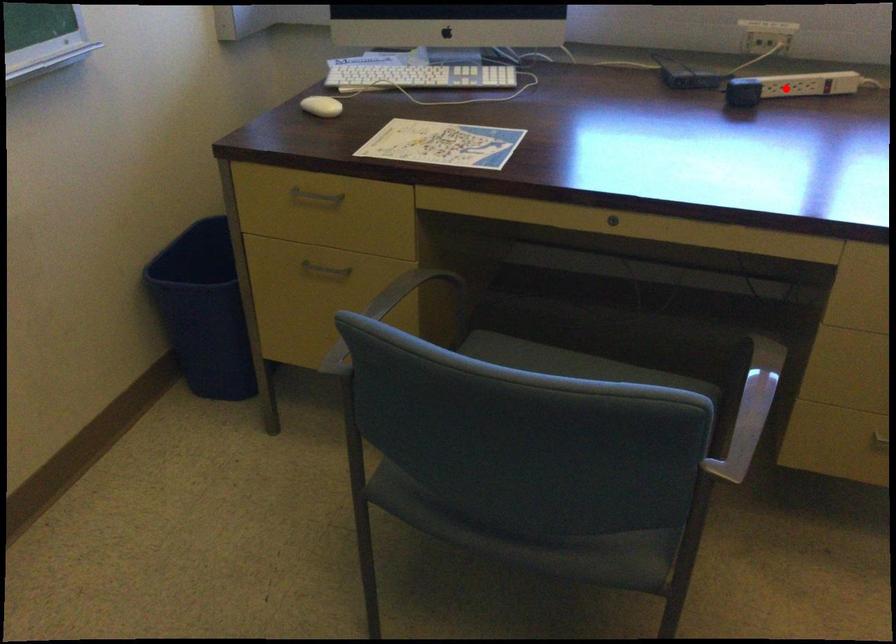
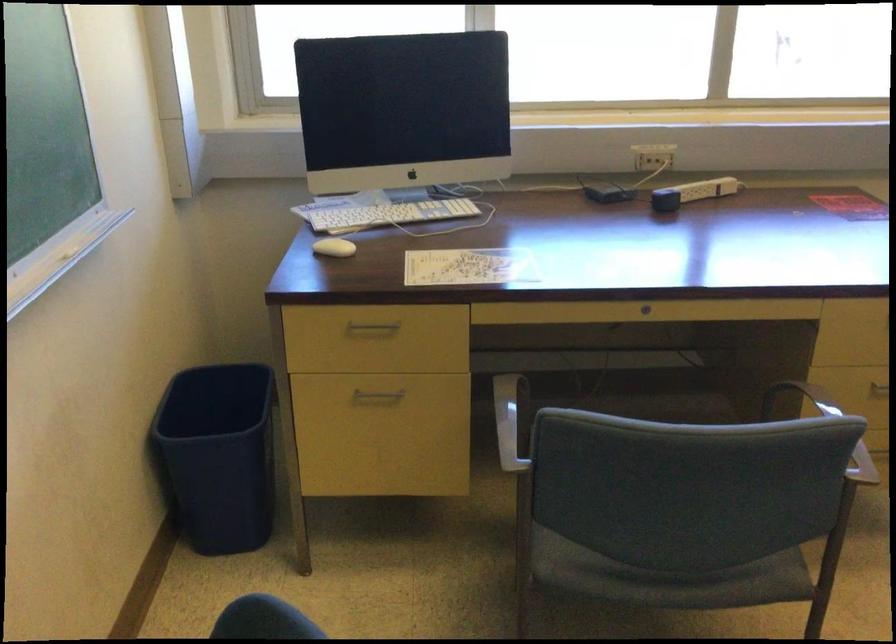
Where in the second image is the point corresponding to the highlighted location from the first image?

(692, 193)